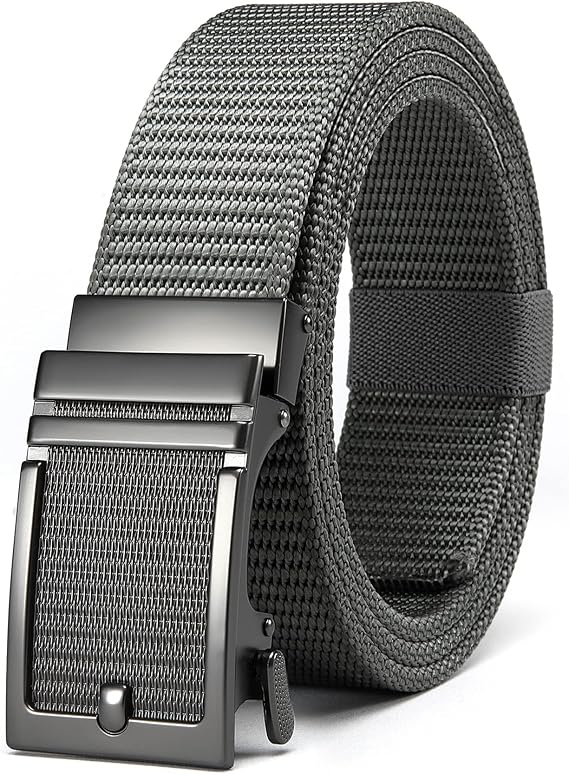
The image size is (569, 774). In order to click on metal hinge in this screenshot , I will do `click(262, 683)`.